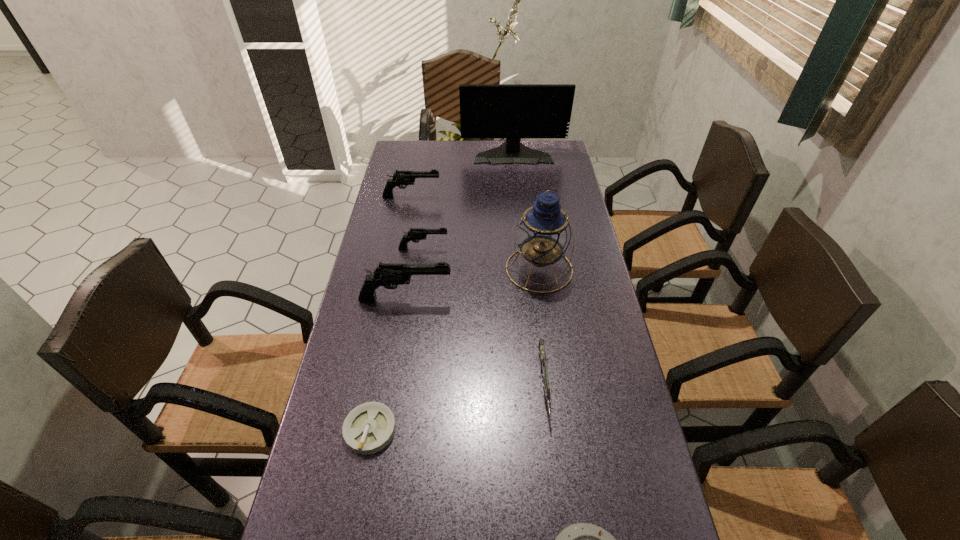
At what (x,y) coordinates should I click in order to perform the action: click on ashtray. Please return your answer as a coordinate pair (x, y). Looking at the image, I should click on (368, 428).

You are a GUI agent. You are given a task and a screenshot of the screen. Output one action in this format:
    pyautogui.click(x=<x>, y=<y>)
    Task: Click on the gray ashtray
    This screenshot has width=960, height=540.
    Given the screenshot: What is the action you would take?
    pyautogui.click(x=368, y=428)

Locate an element on the screen. vacant space located on the screen side of the monitor is located at coordinates (516, 179).

Image resolution: width=960 pixels, height=540 pixels. What are the coordinates of `free space located 0.140m on the front-facing side of the blue lantern` in the screenshot? It's located at (547, 331).

In order to click on free space located 0.220m at the end of the barrel of the nearest black gun in this screenshot , I will do `click(527, 299)`.

You are a GUI agent. You are given a task and a screenshot of the screen. Output one action in this format:
    pyautogui.click(x=<x>, y=<y>)
    Task: Click on the blank space located at the end of the barrel of the seventh nearest object
    
    Given the screenshot: What is the action you would take?
    pyautogui.click(x=540, y=197)

The image size is (960, 540). I want to click on free space located at the end of the barrel of the fifth tallest object, so click(x=506, y=248).

What are the coordinates of `vacant position located 0.220m aimed along the barrel of the shortest gun` in the screenshot? It's located at coord(562,535).

Locate an element on the screen. This screenshot has height=540, width=960. blank area located 0.140m on the front of the gray ashtray is located at coordinates (352, 525).

Find the location of `object that is positioned at the far edge`. object that is positioned at the far edge is located at coordinates (513, 111).